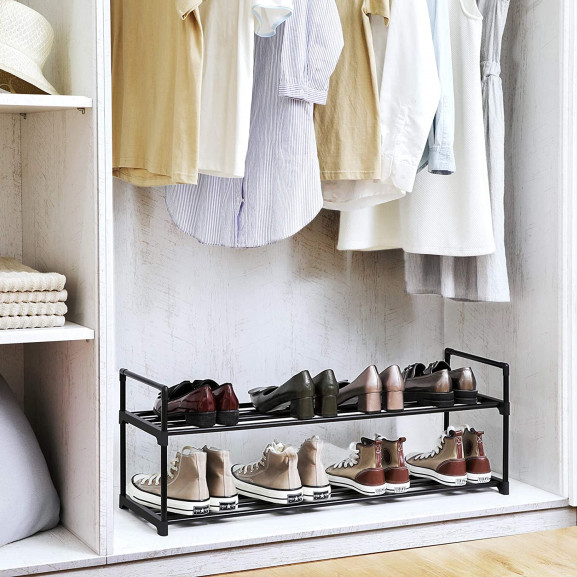
Locate an element on the screen. This screenshot has height=577, width=577. shoes on the top shelf is located at coordinates (196, 397), (224, 400), (298, 394), (325, 394), (358, 387), (392, 383), (426, 380), (456, 378).